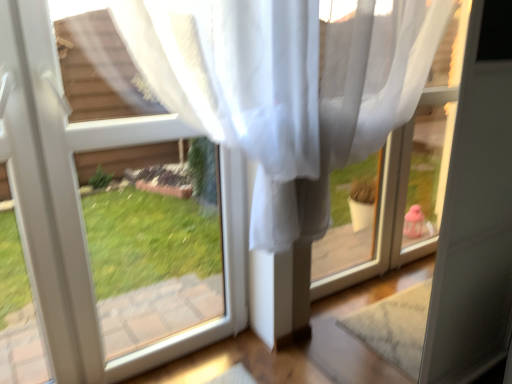
Where is `transparent plastic window frame at upper right`? The image size is (512, 384). transparent plastic window frame at upper right is located at coordinates (390, 137).

The image size is (512, 384). What do you see at coordinates (390, 137) in the screenshot? I see `transparent plastic window frame at upper right` at bounding box center [390, 137].

This screenshot has width=512, height=384. I want to click on transparent fabric at upper left, so click(x=80, y=205).

What do you see at coordinates (80, 205) in the screenshot? Image resolution: width=512 pixels, height=384 pixels. I see `transparent fabric at upper left` at bounding box center [80, 205].

Measure the distance between transparent fabric at upper left and camera.

The distance of transparent fabric at upper left from camera is 3.68 feet.

In order to click on transparent plastic window frame at upper right in this screenshot , I will do `click(390, 137)`.

Which is more to the right, transparent plastic window frame at upper right or transparent fabric at upper left?

transparent plastic window frame at upper right is more to the right.

Which is behind, transparent plastic window frame at upper right or transparent fabric at upper left?

Positioned behind is transparent fabric at upper left.

Is point (424, 230) in front of point (24, 211)?

That is False.

From the image's perspective, which one is positioned lower, transparent plastic window frame at upper right or transparent fabric at upper left?

transparent plastic window frame at upper right, from the image's perspective.

From a real-world perspective, relative to transparent fabric at upper left, is transparent plastic window frame at upper right vertically above or below?

In terms of real-world spatial position, transparent plastic window frame at upper right is below transparent fabric at upper left.

In the scene shown: Looking at their sizes, would you say transparent plastic window frame at upper right is wider or thinner than transparent fabric at upper left?

In the image, transparent plastic window frame at upper right appears to be more narrow than transparent fabric at upper left.

Is transparent plastic window frame at upper right taller than transparent fabric at upper left?

Yes.

Considering the relative sizes of transparent plastic window frame at upper right and transparent fabric at upper left in the image provided, is transparent plastic window frame at upper right bigger than transparent fabric at upper left?

Actually, transparent plastic window frame at upper right might be smaller than transparent fabric at upper left.

Would you say transparent plastic window frame at upper right contains transparent fabric at upper left?

No, transparent fabric at upper left is located outside of transparent plastic window frame at upper right.

Looking at this image, would you say transparent plastic window frame at upper right is a long distance from transparent fabric at upper left?

transparent plastic window frame at upper right is actually quite close to transparent fabric at upper left.

Based on the photo, is transparent plastic window frame at upper right aimed at transparent fabric at upper left?

Yes, transparent plastic window frame at upper right faces towards transparent fabric at upper left.

Measure the distance between transparent plastic window frame at upper right and transparent fabric at upper left.

transparent plastic window frame at upper right and transparent fabric at upper left are 99.26 centimeters apart from each other.

Locate an element on the screen. The width and height of the screenshot is (512, 384). window behind the transparent plastic window frame at upper right is located at coordinates (80, 205).

Visually, is transparent fabric at upper left positioned to the left or to the right of transparent plastic window frame at upper right?

transparent fabric at upper left is to the left of transparent plastic window frame at upper right.

Is the depth of transparent fabric at upper left greater than that of transparent plastic window frame at upper right?

Yes, the depth of transparent fabric at upper left is greater than that of transparent plastic window frame at upper right.

Considering the points (26, 86) and (364, 117), which point is in front, point (26, 86) or point (364, 117)?

The point (26, 86) is closer to the camera.

From the image's perspective, is transparent fabric at upper left located above or below transparent plastic window frame at upper right?

Based on their image positions, transparent fabric at upper left is located above transparent plastic window frame at upper right.

From a real-world perspective, is transparent fabric at upper left positioned over transparent plastic window frame at upper right based on gravity?

Yes, from a real-world perspective, transparent fabric at upper left is above transparent plastic window frame at upper right.

Is transparent fabric at upper left wider than transparent plastic window frame at upper right?

Yes.

Can you confirm if transparent fabric at upper left is shorter than transparent plastic window frame at upper right?

Indeed, transparent fabric at upper left has a lesser height compared to transparent plastic window frame at upper right.

Considering the relative sizes of transparent fabric at upper left and transparent plastic window frame at upper right in the image provided, is transparent fabric at upper left bigger than transparent plastic window frame at upper right?

Yes.

Is transparent fabric at upper left inside the boundaries of transparent plastic window frame at upper right, or outside?

transparent fabric at upper left lies outside transparent plastic window frame at upper right.

Can you see transparent fabric at upper left touching transparent plastic window frame at upper right?

No, transparent fabric at upper left is not beside transparent plastic window frame at upper right.

Is transparent fabric at upper left positioned with its back to transparent plastic window frame at upper right?

No, transparent plastic window frame at upper right is not at the back of transparent fabric at upper left.

Based on the photo, how different are the orientations of transparent fabric at upper left and transparent plastic window frame at upper right in degrees?

They differ by 89.5 degrees in their facing directions.

Image resolution: width=512 pixels, height=384 pixels. Identify the location of window that is behind the transparent plastic window frame at upper right. (80, 205).

Identify the location of window frame below the transparent fabric at upper left (from a real-world perspective). The width and height of the screenshot is (512, 384). (390, 137).

In order to click on window frame below the transparent fabric at upper left (from the image's perspective) in this screenshot , I will do `click(390, 137)`.